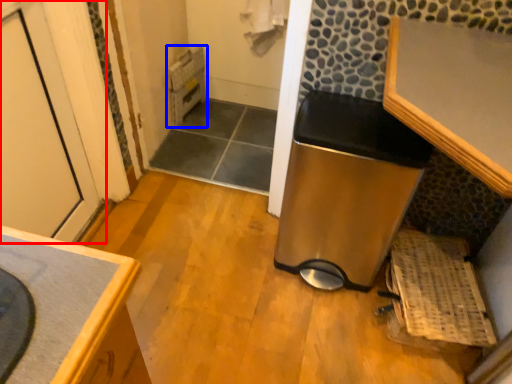
Question: Among these objects, which one is farthest to the camera, door (highlighted by a red box) or water heater (highlighted by a blue box)?

Choices:
 (A) door
 (B) water heater

Answer: (B)